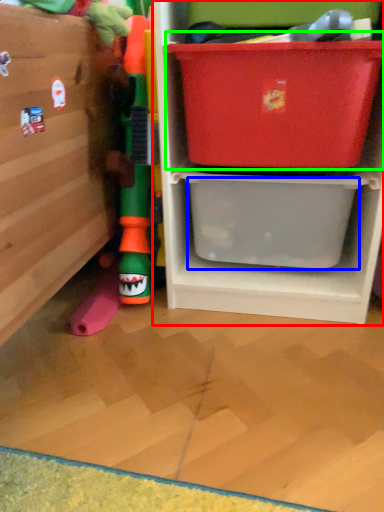
Question: Considering the real-world distances, which object is closest to shelf (highlighted by a red box)? storage box (highlighted by a blue box) or storage box (highlighted by a green box).

Choices:
 (A) storage box
 (B) storage box

Answer: (A)